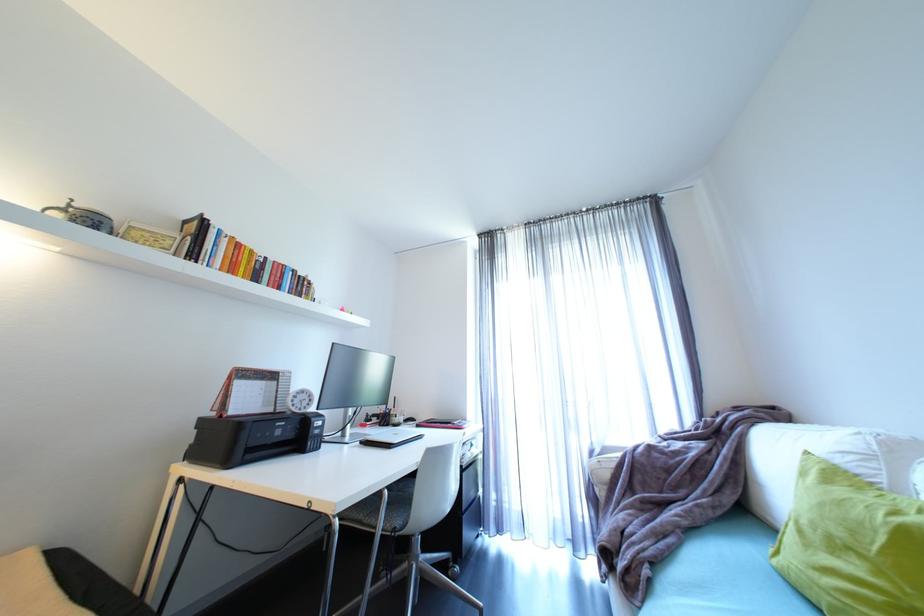
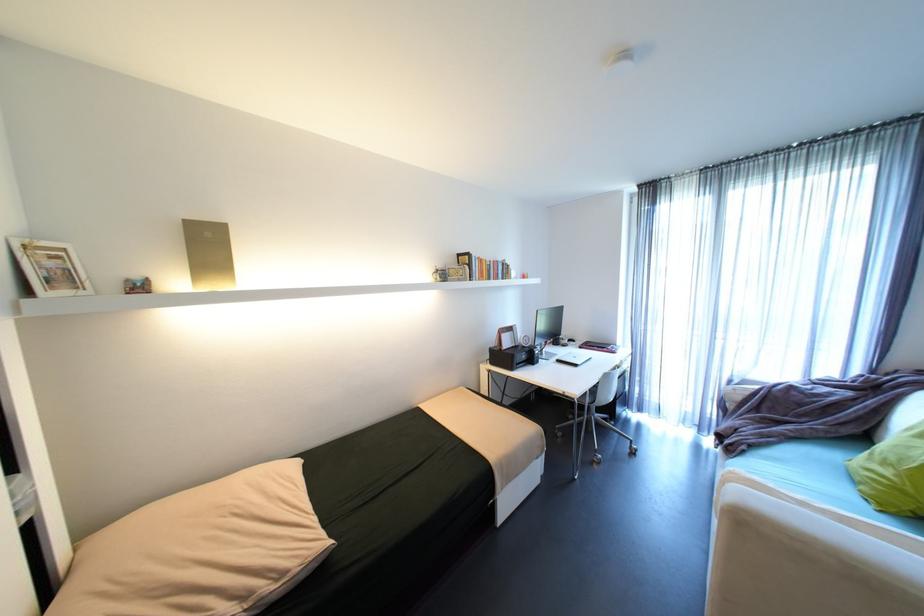
Question: I am providing you with two images of the same scene from different viewpoints. After the viewpoint changes to image2, which objects are now occluded?

Choices:
 (A) sofa sitting surface
 (B) white sofa armrest
 (C) chair sitting surface
 (D) none of these

Answer: (D)